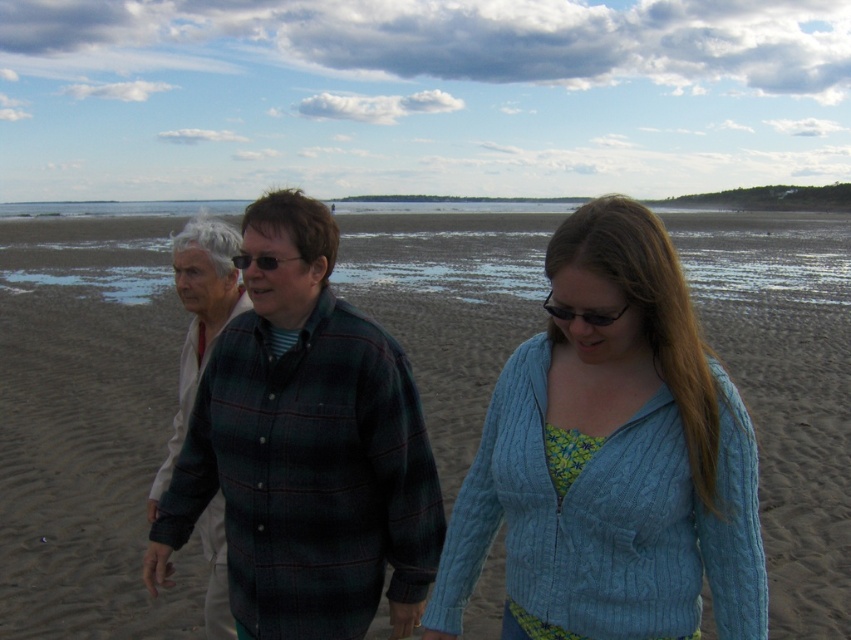
Question: Is cable-knit sweater at center wider than plaid flannel shirt at center?

Choices:
 (A) no
 (B) yes

Answer: (B)

Question: In this image, where is brown sandy beach at center located relative to black plastic sunglasses at center?

Choices:
 (A) left
 (B) right

Answer: (A)

Question: Which point appears closest to the camera in this image?

Choices:
 (A) (608, 317)
 (B) (255, 264)
 (C) (674, 224)

Answer: (A)

Question: Which object is farther from the camera taking this photo?

Choices:
 (A) green plaid shirt at center
 (B) plaid flannel shirt at center

Answer: (B)

Question: Which point is farther to the camera?

Choices:
 (A) (455, 426)
 (B) (210, 534)
 (C) (578, 314)

Answer: (A)

Question: Is cable-knit sweater at center closer to camera compared to plaid flannel shirt at center?

Choices:
 (A) no
 (B) yes

Answer: (B)